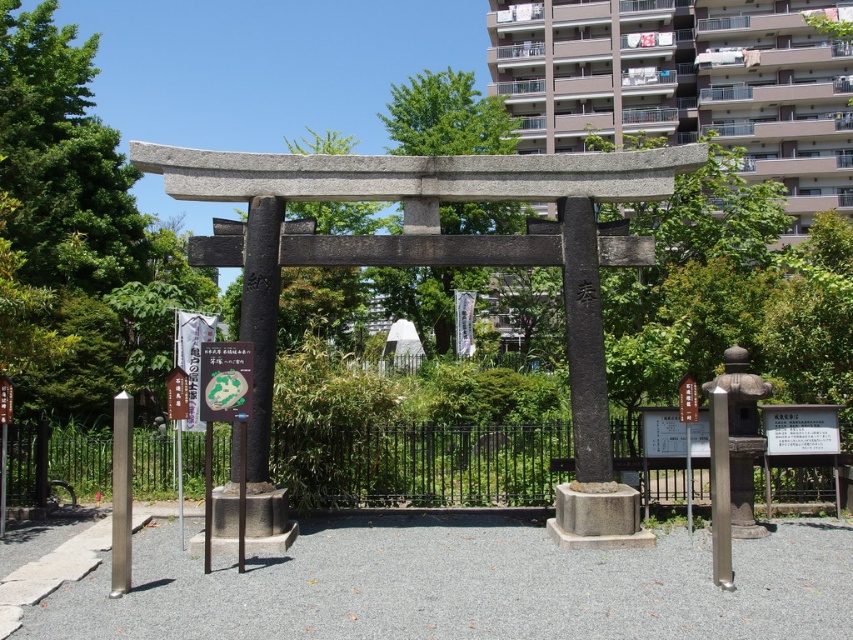
Between green leafy tree at center and wooden signpost at center, which one appears on the left side from the viewer's perspective?

green leafy tree at center

Which is behind, point (416, 269) or point (688, 420)?

The point (416, 269) is more distant.

The image size is (853, 640). I want to click on green leafy tree at center, so click(x=445, y=116).

Which is below, green leafy tree at center or green paper at center?

Positioned lower is green paper at center.

Consider the image. Is green leafy tree at center to the right of green paper at center from the viewer's perspective?

Correct, you'll find green leafy tree at center to the right of green paper at center.

Is point (445, 225) closer to viewer compared to point (225, 387)?

No, it is not.

At what (x,y) coordinates should I click in order to perform the action: click on green leafy tree at center. Please return your answer as a coordinate pair (x, y). This screenshot has height=640, width=853. Looking at the image, I should click on (445, 116).

In the scene shown: Is green paper at center smaller than silver metallic pole at center?

Indeed, green paper at center has a smaller size compared to silver metallic pole at center.

Where is `green paper at center`? This screenshot has height=640, width=853. green paper at center is located at coordinates (225, 380).

Image resolution: width=853 pixels, height=640 pixels. Describe the element at coordinates (225, 380) in the screenshot. I see `green paper at center` at that location.

Image resolution: width=853 pixels, height=640 pixels. I want to click on green paper at center, so click(x=225, y=380).